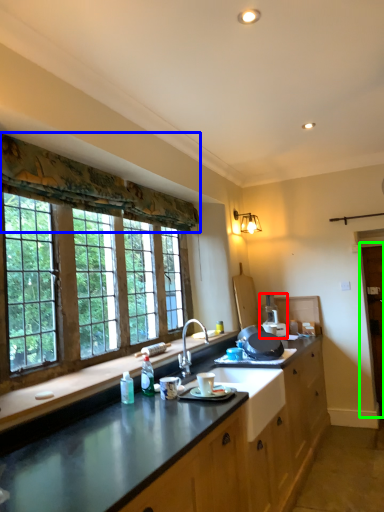
Question: Which object is the farthest from appliance (highlighted by a red box)? Choose among these: curtain (highlighted by a blue box) or barn door (highlighted by a green box).

Choices:
 (A) curtain
 (B) barn door

Answer: (A)